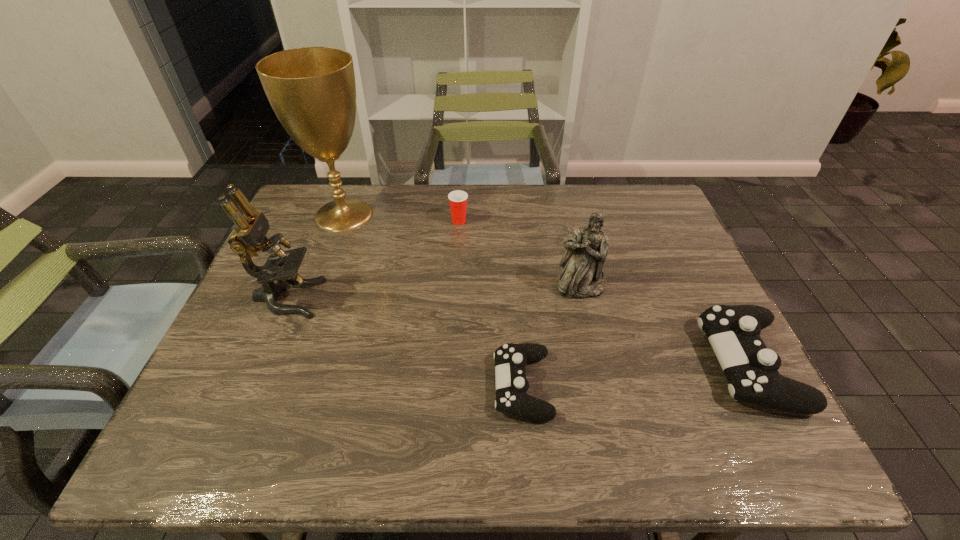
The height and width of the screenshot is (540, 960). Identify the location of empty space between the rightmost object and the shortest object. (636, 375).

The height and width of the screenshot is (540, 960). I want to click on object that stands as the fourth closest to the tallest object, so click(x=582, y=277).

Select which object appears as the second closest to the fifth object from left to right. Please provide its 2D coordinates. Your answer should be formatted as a tuple, i.e. [(x, y)], where the tuple contains the x and y coordinates of a point satisfying the conditions above.

[(751, 369)]

Identify the location of free location that satisfies the following two spatial constraints: 1. on the front side of the tallest object; 2. at the eyepieces of the microscope. (313, 298).

The height and width of the screenshot is (540, 960). In order to click on free space that satisfies the following two spatial constraints: 1. on the front side of the tallest object; 2. at the eyepieces of the microscope in this screenshot , I will do `click(313, 298)`.